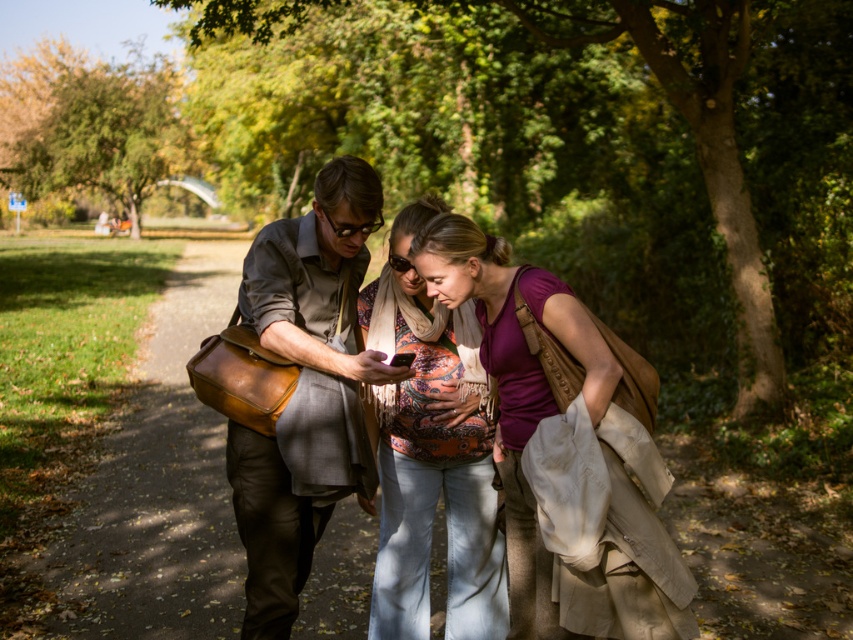
Question: Where is purple cotton shirt at center located in relation to matte brown leather bag at center in the image?

Choices:
 (A) below
 (B) above

Answer: (A)

Question: Does matte brown leather bag at center have a larger size compared to matte orange scarf at center?

Choices:
 (A) yes
 (B) no

Answer: (B)

Question: Which object appears farthest from the camera in this image?

Choices:
 (A) matte brown leather bag at center
 (B) purple cotton shirt at center

Answer: (A)

Question: Does purple cotton shirt at center have a larger size compared to matte brown leather bag at center?

Choices:
 (A) yes
 (B) no

Answer: (A)

Question: Which point is closer to the camera taking this photo?

Choices:
 (A) (630, 420)
 (B) (476, 397)

Answer: (A)

Question: Which of the following is the closest to the observer?

Choices:
 (A) matte brown leather bag at center
 (B) matte orange scarf at center
 (C) purple cotton shirt at center

Answer: (C)